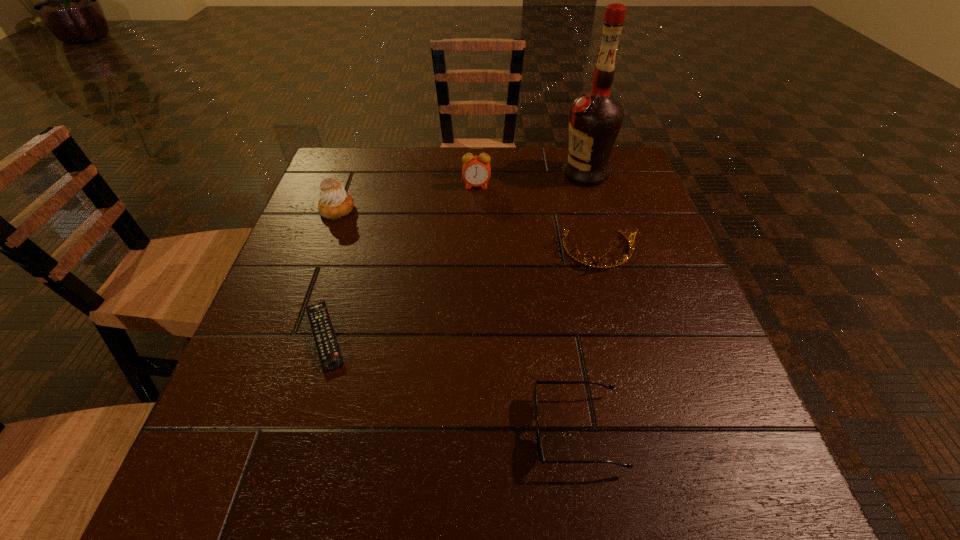
Identify the location of free space at the left edge of the desktop. This screenshot has height=540, width=960. (284, 319).

This screenshot has width=960, height=540. In order to click on free space at the right edge of the desktop in this screenshot , I will do `click(684, 444)`.

In the image, there is a desktop. Where is `vacant space at the far left corner`? The height and width of the screenshot is (540, 960). vacant space at the far left corner is located at coordinates coord(373,147).

What are the coordinates of `vacant space at the near left corner of the desktop` in the screenshot? It's located at (214, 466).

This screenshot has width=960, height=540. I want to click on empty location between the shortest object and the alarm clock, so click(x=400, y=261).

Find the location of a particular element. The height and width of the screenshot is (540, 960). vacant space in between the fourth object from right to left and the shortest object is located at coordinates (400, 261).

The width and height of the screenshot is (960, 540). I want to click on blank region between the second nearest object and the tallest object, so click(x=455, y=255).

In order to click on vacant area that lies between the tallest object and the second tallest object in this screenshot , I will do `click(531, 180)`.

You are a GUI agent. You are given a task and a screenshot of the screen. Output one action in this format:
    pyautogui.click(x=<x>, y=<y>)
    Task: Click on the free area in between the second nearest object and the pastry
    The width and height of the screenshot is (960, 540).
    Given the screenshot: What is the action you would take?
    pyautogui.click(x=331, y=272)

Where is `empty space that is in between the fourth object from right to left and the tallest object`? empty space that is in between the fourth object from right to left and the tallest object is located at coordinates (531, 180).